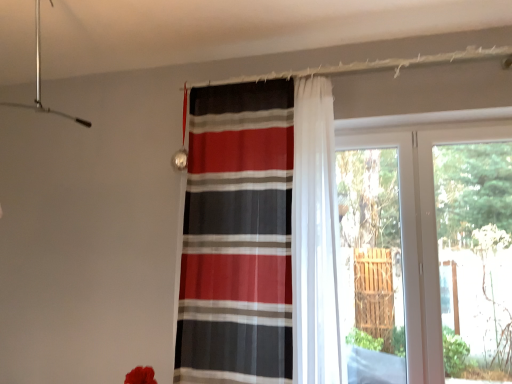
Question: From a real-world perspective, is transparent glass door at right above or below transparent glass screen door at right?

Choices:
 (A) below
 (B) above

Answer: (B)

Question: Visually, is transparent glass door at right positioned to the left or to the right of transparent glass screen door at right?

Choices:
 (A) right
 (B) left

Answer: (A)

Question: Estimate the real-world distances between objects in this image. Which object is farther from the transparent glass door at right?

Choices:
 (A) striped fabric curtain at center
 (B) transparent glass screen door at right

Answer: (A)

Question: Which of these objects is positioned farthest from the transparent glass screen door at right?

Choices:
 (A) transparent glass door at right
 (B) striped fabric curtain at center

Answer: (B)